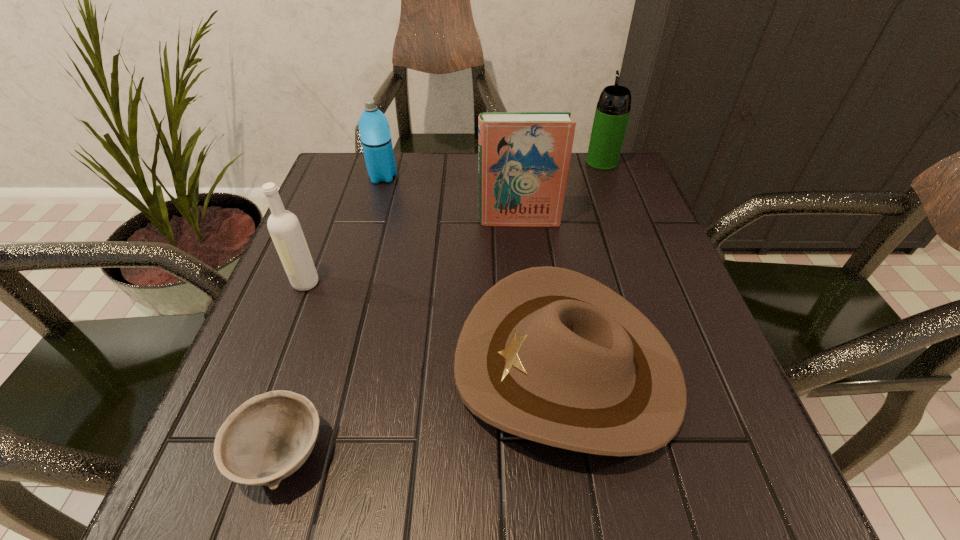
Where is `object located at the far left corner`? The image size is (960, 540). object located at the far left corner is located at coordinates (375, 135).

Where is `object at the near left corner`? This screenshot has width=960, height=540. object at the near left corner is located at coordinates (270, 436).

You are a GUI agent. You are given a task and a screenshot of the screen. Output one action in this format:
    pyautogui.click(x=<x>, y=<y>)
    Task: Click on the object that is positioned at the far right corner
    The width and height of the screenshot is (960, 540).
    Given the screenshot: What is the action you would take?
    pyautogui.click(x=612, y=112)

This screenshot has height=540, width=960. I want to click on object present at the near right corner, so click(548, 354).

Find the location of a particular element. This screenshot has width=960, height=540. free location at the far edge is located at coordinates pyautogui.click(x=414, y=171).

The height and width of the screenshot is (540, 960). I want to click on vacant space at the near edge, so click(x=645, y=475).

Where is `vacant space at the left edge of the desktop`? This screenshot has width=960, height=540. vacant space at the left edge of the desktop is located at coordinates (348, 267).

Find the location of a particular element. The width and height of the screenshot is (960, 540). blank space at the right edge of the desktop is located at coordinates (670, 261).

Where is `free space at the far right corner of the desktop`? This screenshot has width=960, height=540. free space at the far right corner of the desktop is located at coordinates (637, 198).

You are a GUI agent. You are given a task and a screenshot of the screen. Output one action in this format:
    pyautogui.click(x=<x>, y=<y>)
    Task: Click on the empty location between the shortest object and the third farthest object
    
    Given the screenshot: What is the action you would take?
    pyautogui.click(x=400, y=337)